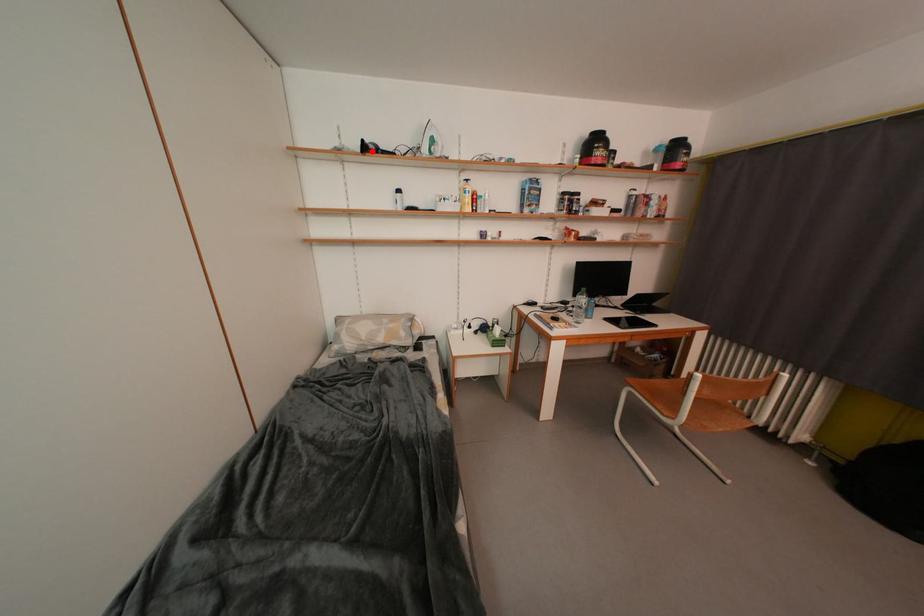
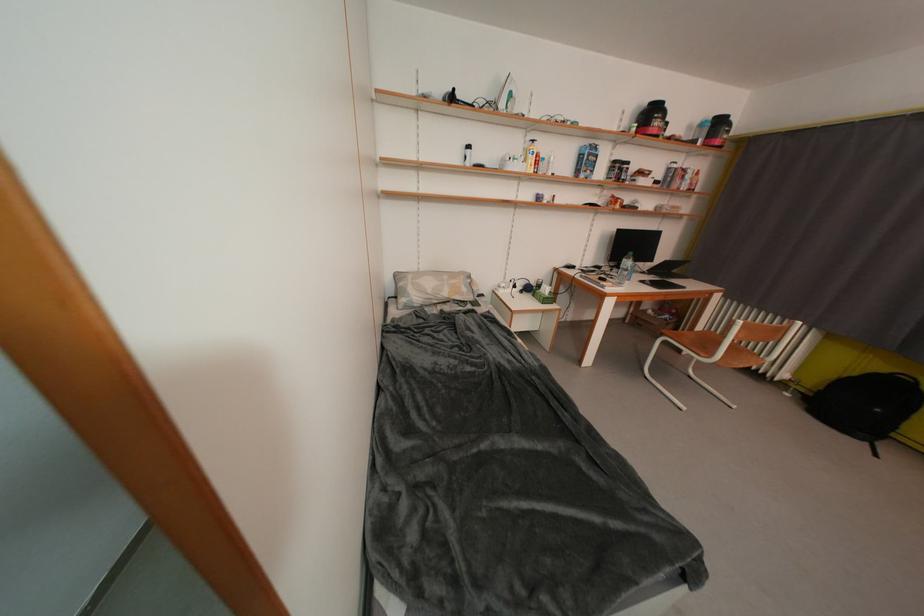
Question: I am providing you with two images of the same scene from different viewpoints. A red point is marked on the first image. Can you still see the location of the red point in image 2?

Choices:
 (A) Yes
 (B) No

Answer: (A)